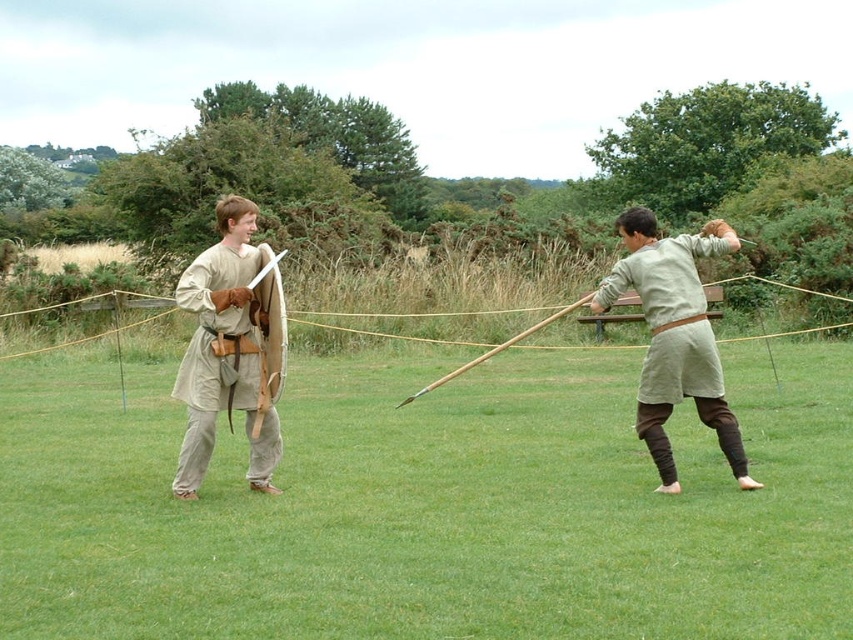
Question: Is light beige fabric shirt at left thinner than light beige fabric shirt at right?

Choices:
 (A) yes
 (B) no

Answer: (A)

Question: Can you confirm if light beige fabric shirt at left is positioned above light beige fabric shirt at right?

Choices:
 (A) no
 (B) yes

Answer: (A)

Question: Does green grass at center have a larger size compared to light beige fabric shirt at left?

Choices:
 (A) no
 (B) yes

Answer: (B)

Question: Estimate the real-world distances between objects in this image. Which object is closer to the light beige fabric shirt at left?

Choices:
 (A) light beige fabric shirt at right
 (B) green grass at center

Answer: (A)

Question: Which point is farther to the camera?

Choices:
 (A) green grass at center
 (B) light beige fabric shirt at left
 (C) light beige fabric shirt at right

Answer: (C)

Question: Which point is farther from the camera taking this photo?

Choices:
 (A) (669, 304)
 (B) (254, 362)
 (C) (828, 609)

Answer: (B)